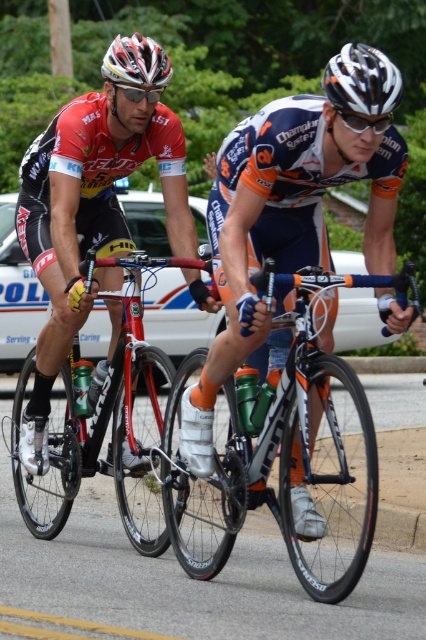
Is matte black bicycle at left wider than multicolored glossy bicycle helmet at upper center?

Yes, matte black bicycle at left is wider than multicolored glossy bicycle helmet at upper center.

Can you confirm if matte black bicycle at left is taller than multicolored glossy bicycle helmet at upper center?

Indeed, matte black bicycle at left has a greater height compared to multicolored glossy bicycle helmet at upper center.

What do you see at coordinates (89, 220) in the screenshot?
I see `matte black bicycle at left` at bounding box center [89, 220].

Where is `matte black bicycle at left`? The height and width of the screenshot is (640, 426). matte black bicycle at left is located at coordinates (89, 220).

Between white matte bicycle helmet at upper center and multicolored glossy bicycle helmet at upper center, which one is positioned higher?

white matte bicycle helmet at upper center is higher up.

Can you confirm if white matte bicycle helmet at upper center is positioned to the left of multicolored glossy bicycle helmet at upper center?

No, white matte bicycle helmet at upper center is not to the left of multicolored glossy bicycle helmet at upper center.

I want to click on white matte bicycle helmet at upper center, so click(362, 81).

Can you confirm if shiny red bicycle at center is positioned to the right of multicolored glossy bicycle helmet at upper center?

Indeed, shiny red bicycle at center is positioned on the right side of multicolored glossy bicycle helmet at upper center.

Which is above, shiny red bicycle at center or multicolored glossy bicycle helmet at upper center?

multicolored glossy bicycle helmet at upper center is higher up.

Between point (131, 294) and point (163, 68), which one is positioned in front?

Point (163, 68) is more forward.

Image resolution: width=426 pixels, height=640 pixels. I want to click on shiny red bicycle at center, so click(103, 419).